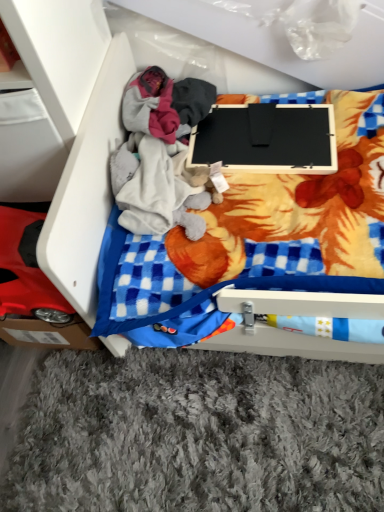
Question: Is black matte laptop at center bigger or smaller than white plastic drawer at upper left?

Choices:
 (A) big
 (B) small

Answer: (B)

Question: Considering the positions of point (226, 138) and point (76, 270), is point (226, 138) closer or farther from the camera than point (76, 270)?

Choices:
 (A) farther
 (B) closer

Answer: (A)

Question: Considering their positions, is black matte laptop at center located in front of or behind white plastic drawer at upper left?

Choices:
 (A) behind
 (B) front

Answer: (A)

Question: Is white plastic drawer at upper left wider or thinner than black matte laptop at center?

Choices:
 (A) wide
 (B) thin

Answer: (A)

Question: Is white plastic drawer at upper left situated inside black matte laptop at center or outside?

Choices:
 (A) inside
 (B) outside

Answer: (B)

Question: Considering the relative positions of white plastic drawer at upper left and black matte laptop at center in the image provided, is white plastic drawer at upper left to the left or to the right of black matte laptop at center?

Choices:
 (A) right
 (B) left

Answer: (B)

Question: From their relative heights in the image, would you say white plastic drawer at upper left is taller or shorter than black matte laptop at center?

Choices:
 (A) short
 (B) tall

Answer: (B)